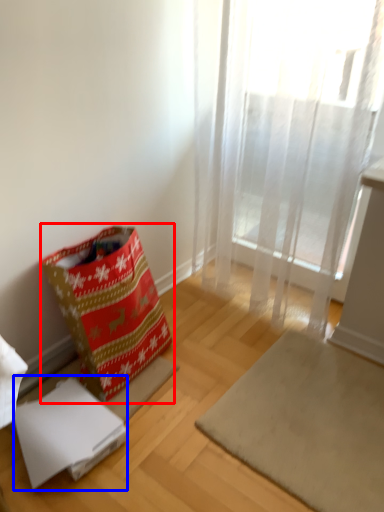
Question: Which object appears farthest to the camera in this image, gift bag (highlighted by a red box) or cardboard box (highlighted by a blue box)?

Choices:
 (A) gift bag
 (B) cardboard box

Answer: (B)